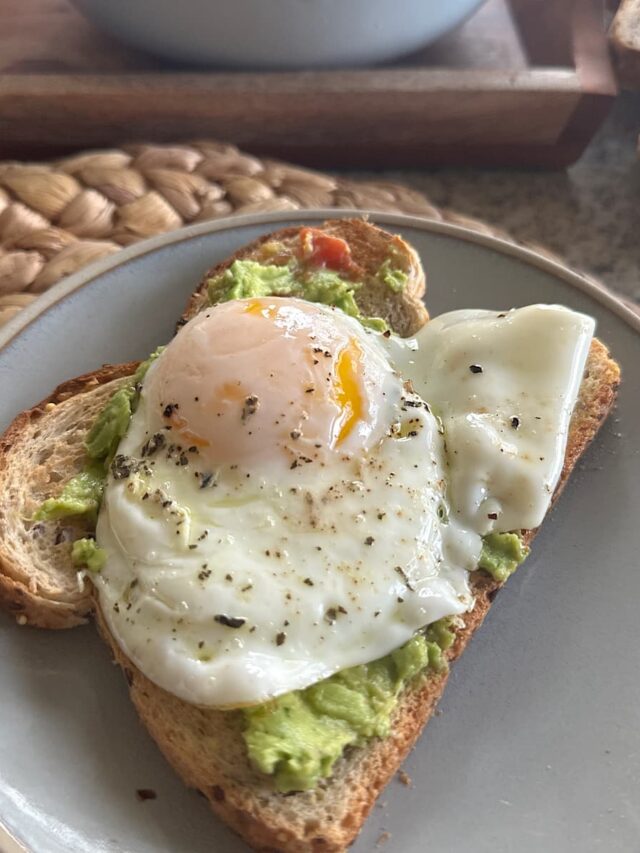
Find the location of `plate`. plate is located at coordinates (507, 756).